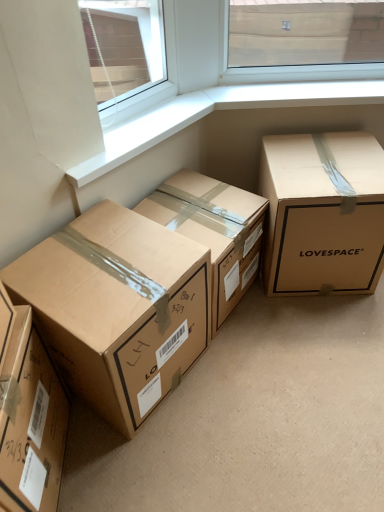
Question: From a real-world perspective, is matte cardboard box at right, the fourth box in the left-to-right sequence, positioned above or below white smooth window sill at upper center?

Choices:
 (A) below
 (B) above

Answer: (A)

Question: Based on their sizes in the image, would you say matte cardboard box at right, which is counted as the 1th box, starting from the right, is bigger or smaller than white smooth window sill at upper center?

Choices:
 (A) big
 (B) small

Answer: (A)

Question: Estimate the real-world distances between objects in this image. Which object is farther from the matte cardboard box at right, which is counted as the 1th box, starting from the right?

Choices:
 (A) brown cardboard box at center, which is counted as the third box, starting from the left
 (B) brown cardboard box at lower left, the first box viewed from the left
 (C) white smooth window sill at upper center
 (D) brown cardboard box at lower left, the 3th box viewed from the right

Answer: (B)

Question: Which object is positioned closest to the matte cardboard box at right, the fourth box in the left-to-right sequence?

Choices:
 (A) white smooth window sill at upper center
 (B) brown cardboard box at center, which is counted as the third box, starting from the left
 (C) brown cardboard box at lower left, the first box viewed from the left
 (D) brown cardboard box at lower left, which ranks as the second box in left-to-right order

Answer: (B)